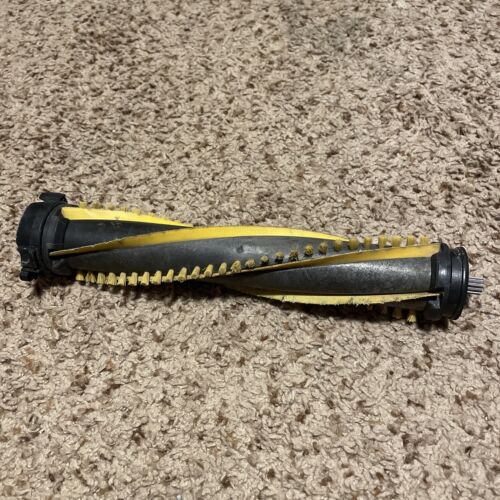
Where is `shag carpet`? The height and width of the screenshot is (500, 500). shag carpet is located at coordinates (193, 370), (269, 163), (413, 162), (128, 109), (365, 398), (58, 393).